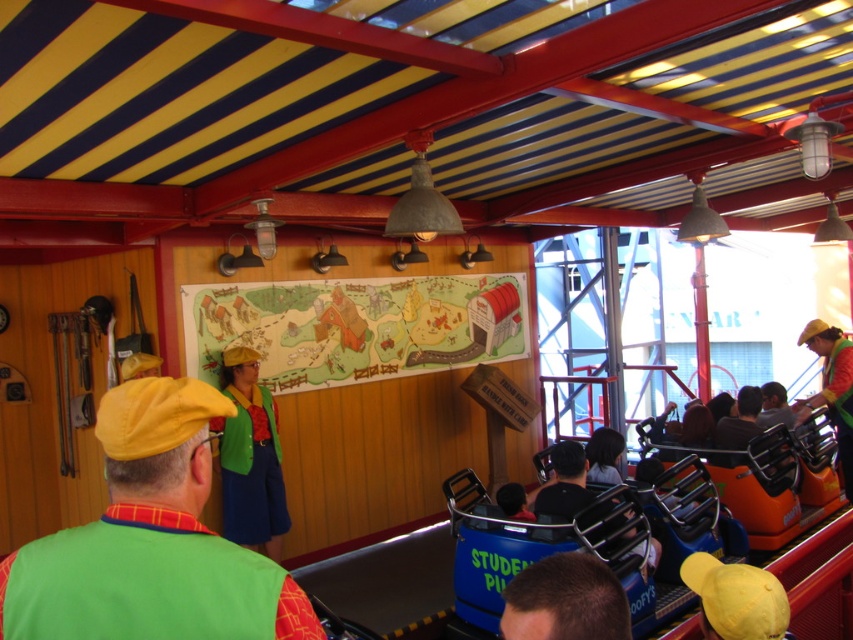
You are a costume designer looking at the image of the themed ride interior. You need to decide which object, the green fabric vest at center or the dark brown hair at lower center, requires more fabric for its creation. Based on the description, which one would need more material?

The green fabric vest at center is larger in size than the dark brown hair at lower center, so it would require more fabric for its creation.